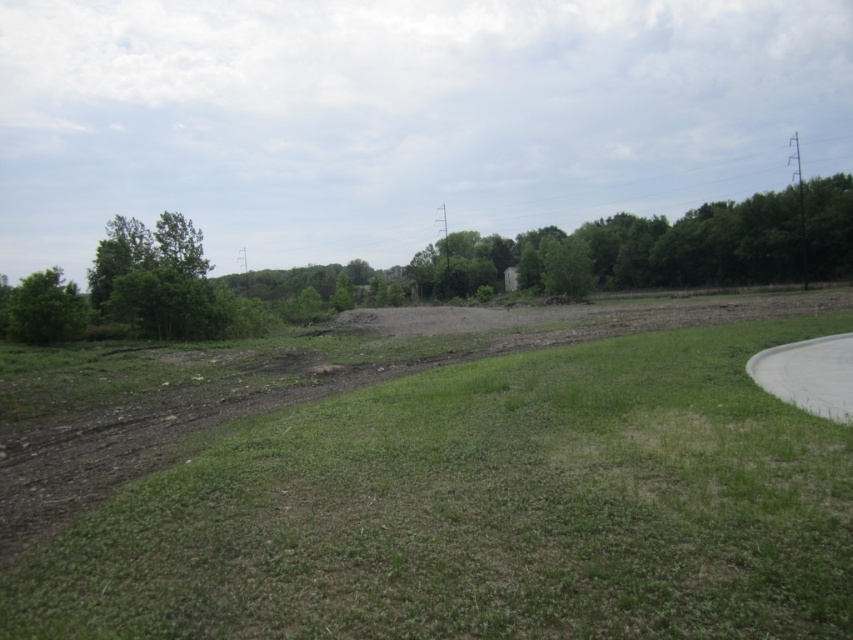
Question: Can you confirm if green grass at center is positioned to the right of green leafy tree at left?

Choices:
 (A) yes
 (B) no

Answer: (A)

Question: Does green grass at center have a smaller size compared to green leafy tree at left?

Choices:
 (A) no
 (B) yes

Answer: (B)

Question: Does green grass at center come in front of green leafy tree at left?

Choices:
 (A) no
 (B) yes

Answer: (B)

Question: Among these points, which one is nearest to the camera?

Choices:
 (A) (38, 272)
 (B) (392, 493)

Answer: (B)

Question: Which point appears farthest from the camera in this image?

Choices:
 (A) (74, 314)
 (B) (619, 472)

Answer: (A)